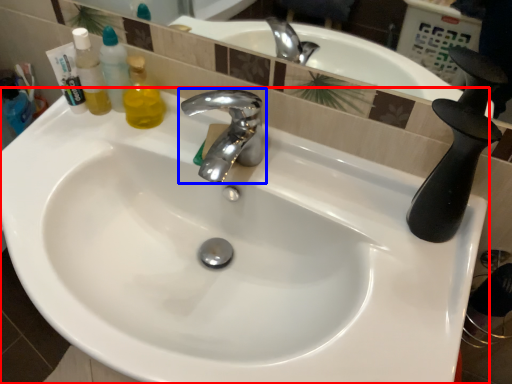
Question: Among these objects, which one is nearest to the camera, sink (highlighted by a red box) or tap (highlighted by a blue box)?

Choices:
 (A) sink
 (B) tap

Answer: (A)